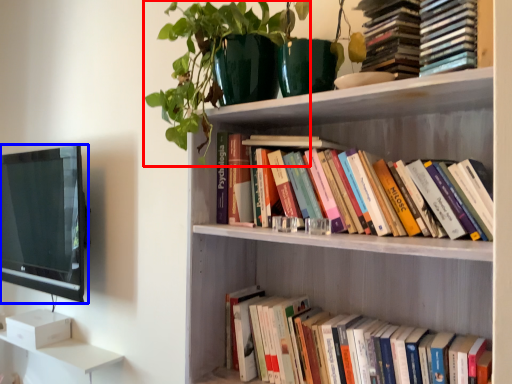
Question: Which of the following is the closest to the observer, plant (highlighted by a red box) or television (highlighted by a blue box)?

Choices:
 (A) plant
 (B) television

Answer: (A)